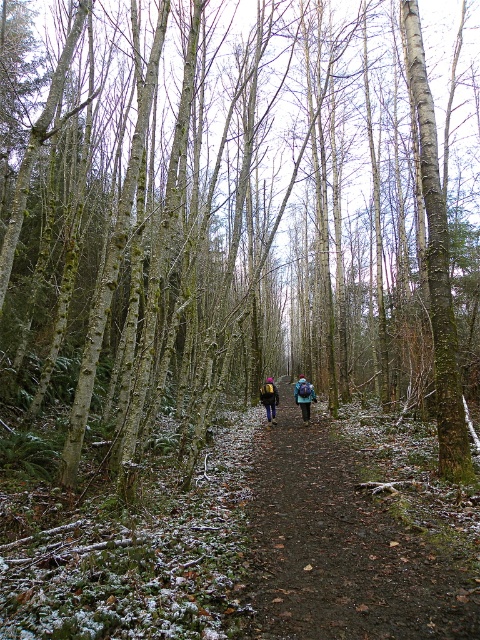
Question: Observing the image, what is the correct spatial positioning of blue fabric backpack at center in reference to blue fabric jacket at center?

Choices:
 (A) below
 (B) above

Answer: (A)

Question: Does brown dirt path at center lie behind blue fabric backpack at center?

Choices:
 (A) yes
 (B) no

Answer: (B)

Question: Does blue fabric backpack at center appear over blue fabric jacket at center?

Choices:
 (A) yes
 (B) no

Answer: (B)

Question: Among these points, which one is farthest from the camera?

Choices:
 (A) (308, 404)
 (B) (304, 509)
 (C) (263, 396)
 (D) (302, 381)

Answer: (C)

Question: Which of the following is the closest to the observer?

Choices:
 (A) [x=294, y=394]
 (B) [x=447, y=621]

Answer: (B)

Question: Which object is positioned closest to the matte blue jacket at center?

Choices:
 (A) brown dirt path at center
 (B) blue fabric jacket at center
 (C) blue fabric backpack at center

Answer: (C)